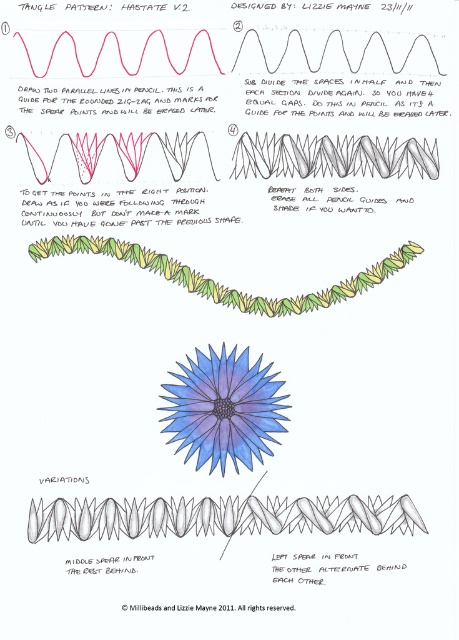
You are an artist following the instructions and need to determine the order of steps. After completing Step 1, you move to Step 2. When drawing the next part of the pattern, which point should you start with first, point at position [229,404] or point at position [212,292]?

You should start with point at position [229,404] first because it is closer to the viewer than point at position [212,292].

Looking at this image, you are following the tangle pattern instructions and see two points labeled point (44, 529) and point (186, 426). Which point is closer to you when looking at the pattern?

Point (44, 529) is in front of point (186, 426), so it is closer to you.